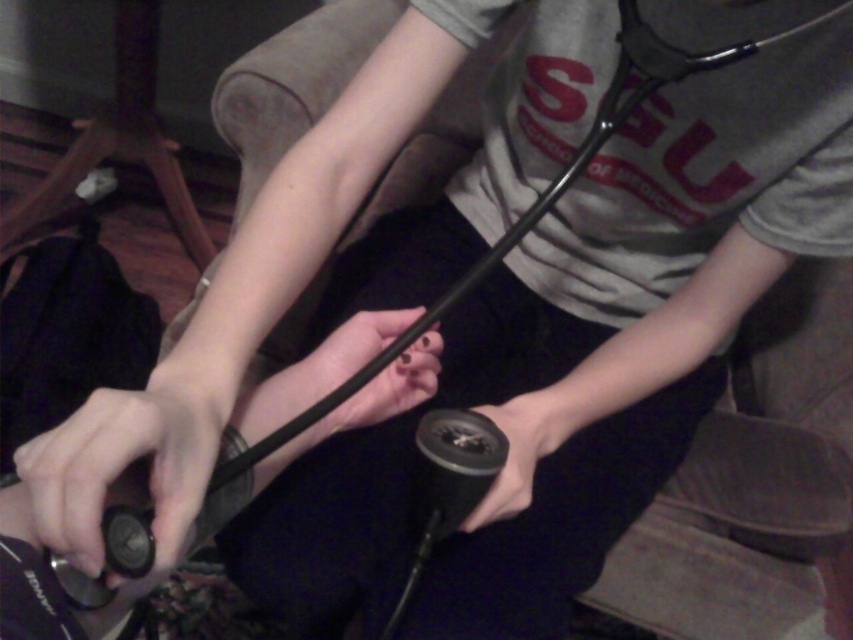
The height and width of the screenshot is (640, 853). I want to click on matte black wristwatch at lower left, so click(x=103, y=492).

Measure the distance between point (106,509) and camera.

A distance of 15.79 inches exists between point (106,509) and camera.

Locate an element on the screen. The width and height of the screenshot is (853, 640). matte black wristwatch at lower left is located at coordinates (103, 492).

Does matte black wristwatch at lower left have a lesser height compared to black rubber grip at center?

Indeed, matte black wristwatch at lower left has a lesser height compared to black rubber grip at center.

Is matte black wristwatch at lower left to the left of black rubber grip at center from the viewer's perspective?

Correct, you'll find matte black wristwatch at lower left to the left of black rubber grip at center.

Between point (35, 493) and point (485, 404), which one is positioned behind?

Point (485, 404)

Identify the location of matte black wristwatch at lower left. (103, 492).

Is black matte cable at center wider than black rubber grip at center?

Correct, the width of black matte cable at center exceeds that of black rubber grip at center.

Which of these two, black matte cable at center or black rubber grip at center, stands taller?

With more height is black matte cable at center.

Image resolution: width=853 pixels, height=640 pixels. Identify the location of black matte cable at center. (392, 387).